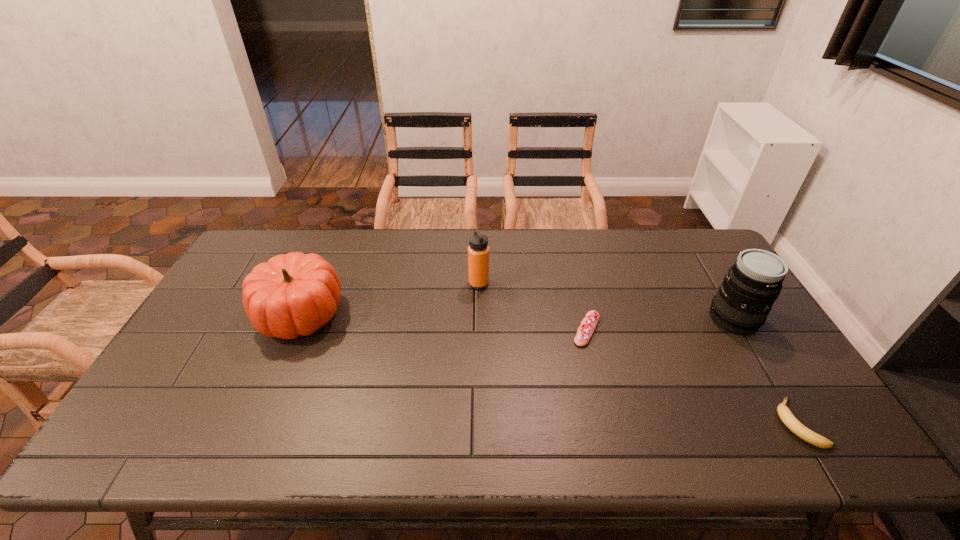
You are a GUI agent. You are given a task and a screenshot of the screen. Output one action in this format:
    pyautogui.click(x=<x>, y=<y>)
    Task: Click on the vacant area situated on the front of the third object from left to right
    The image size is (960, 540).
    Given the screenshot: What is the action you would take?
    pyautogui.click(x=616, y=452)

Find the location of a particular element. free location located on the left of the shortest object is located at coordinates (622, 423).

This screenshot has height=540, width=960. In order to click on object situated at the near edge in this screenshot , I will do `click(791, 422)`.

The height and width of the screenshot is (540, 960). I want to click on object present at the left edge, so click(293, 294).

At what (x,y) coordinates should I click in order to perform the action: click on telephoto lens that is at the right edge. Please return your answer as a coordinate pair (x, y). Looking at the image, I should click on coord(742,303).

Where is `banana that is positioned at the right edge`? This screenshot has height=540, width=960. banana that is positioned at the right edge is located at coordinates (791, 422).

Image resolution: width=960 pixels, height=540 pixels. I want to click on object present at the near right corner, so click(x=791, y=422).

Image resolution: width=960 pixels, height=540 pixels. Identify the location of vacant space at the far edge. (560, 247).

Identify the location of vacant space at the near edge of the desktop. pos(378,446).

Identify the location of free space at the left edge. pos(230,334).